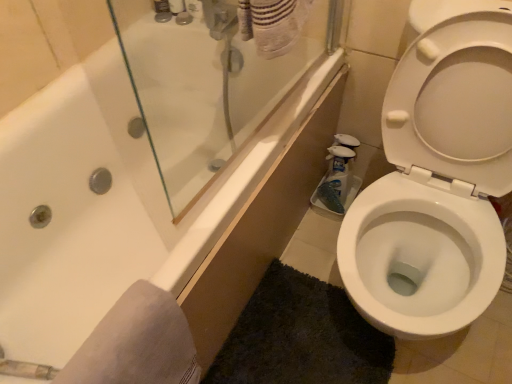
The image size is (512, 384). What do you see at coordinates (301, 337) in the screenshot? I see `dark gray shaggy bath mat at lower right` at bounding box center [301, 337].

In order to face gray soft towel at lower left, should I rotate leftwards or rightwards?

Rotate left and turn 13.351 degrees.

What do you see at coordinates (437, 176) in the screenshot? The image size is (512, 384). I see `white glossy toilet at right` at bounding box center [437, 176].

The width and height of the screenshot is (512, 384). What do you see at coordinates (194, 8) in the screenshot? I see `white plastic bottle at upper center, which appears as the first toiletry when viewed from the right` at bounding box center [194, 8].

You are a GUI agent. You are given a task and a screenshot of the screen. Output one action in this format:
    pyautogui.click(x=<x>, y=<y>)
    Task: Click on the dark gray shaggy bath mat at lower right
    
    Given the screenshot: What is the action you would take?
    pyautogui.click(x=301, y=337)

From a real-world perspective, is gray soft towel at lower left under white plastic soap dispenser at upper center, the 2th toiletry positioned from the right?

Yes, from a real-world perspective, gray soft towel at lower left is under white plastic soap dispenser at upper center, the 2th toiletry positioned from the right.

Are gray soft towel at lower left and white plastic soap dispenser at upper center, acting as the second toiletry starting from the left, located far from each other?

Indeed, gray soft towel at lower left is not near white plastic soap dispenser at upper center, acting as the second toiletry starting from the left.

Is gray soft towel at lower left to the left of white plastic soap dispenser at upper center, acting as the second toiletry starting from the left, from the viewer's perspective?

No, gray soft towel at lower left is not to the left of white plastic soap dispenser at upper center, acting as the second toiletry starting from the left.

Considering the sizes of gray soft towel at lower left and white plastic soap dispenser at upper center, acting as the second toiletry starting from the left, in the image, is gray soft towel at lower left taller or shorter than white plastic soap dispenser at upper center, acting as the second toiletry starting from the left,?

Considering their sizes, gray soft towel at lower left has more height than white plastic soap dispenser at upper center, acting as the second toiletry starting from the left.

In terms of height, does dark gray shaggy bath mat at lower right look taller or shorter compared to blue glossy spray bottle at lower right?

In the image, dark gray shaggy bath mat at lower right appears to be shorter than blue glossy spray bottle at lower right.

Choose the correct answer: Is dark gray shaggy bath mat at lower right inside blue glossy spray bottle at lower right or outside it?

dark gray shaggy bath mat at lower right is located beyond the bounds of blue glossy spray bottle at lower right.

Which is behind, point (208, 379) or point (323, 187)?

The point (323, 187) is more distant.

Is dark gray shaggy bath mat at lower right further to camera compared to blue glossy spray bottle at lower right?

No, it is in front of blue glossy spray bottle at lower right.

Between point (383, 207) and point (185, 4), which one is positioned behind?

Positioned behind is point (185, 4).

Between white glossy toilet at right and white plastic bottle at upper center, which appears as the first toiletry when viewed from the right, which one has larger size?

With larger size is white glossy toilet at right.

Locate an element on the screen. the 1st toiletry behind when counting from the white glossy toilet at right is located at coordinates (x=194, y=8).

Is white glossy toilet at right further to the viewer compared to white plastic bottle at upper center, which appears as the first toiletry when viewed from the right?

No, white glossy toilet at right is closer to the camera.

From the image's perspective, is dark gray shaggy bath mat at lower right above or below white plastic soap dispenser at upper center, acting as the second toiletry starting from the left?

dark gray shaggy bath mat at lower right is situated lower than white plastic soap dispenser at upper center, acting as the second toiletry starting from the left, in the image.

Based on their positions, is dark gray shaggy bath mat at lower right located to the left or right of white plastic soap dispenser at upper center, acting as the second toiletry starting from the left?

dark gray shaggy bath mat at lower right is positioned on white plastic soap dispenser at upper center, acting as the second toiletry starting from the left,'s right side.

Measure the distance from dark gray shaggy bath mat at lower right to white plastic soap dispenser at upper center, acting as the second toiletry starting from the left.

dark gray shaggy bath mat at lower right is 1.07 meters away from white plastic soap dispenser at upper center, acting as the second toiletry starting from the left.

How different are the orientations of white plastic soap dispenser at upper center, the 2th toiletry positioned from the right, and white plastic bottle at upper center, which appears as the first toiletry when viewed from the right, in degrees?

There is a 0.00617-degree angle between the facing directions of white plastic soap dispenser at upper center, the 2th toiletry positioned from the right, and white plastic bottle at upper center, which appears as the first toiletry when viewed from the right.

Considering the sizes of objects white plastic soap dispenser at upper center, acting as the second toiletry starting from the left, and white plastic bottle at upper center, which ranks as the third toiletry in left-to-right order, in the image provided, who is taller, white plastic soap dispenser at upper center, acting as the second toiletry starting from the left, or white plastic bottle at upper center, which ranks as the third toiletry in left-to-right order,?

white plastic bottle at upper center, which ranks as the third toiletry in left-to-right order.

At what (x,y) coordinates should I click in order to perform the action: click on the 1st toiletry above the white plastic bottle at upper center, which ranks as the third toiletry in left-to-right order (from the image's perspective). Please return your answer as a coordinate pair (x, y). The image size is (512, 384). Looking at the image, I should click on (177, 6).

Is gray soft towel at lower left facing away from dark gray shaggy bath mat at lower right?

No, gray soft towel at lower left's orientation is not away from dark gray shaggy bath mat at lower right.

Is gray soft towel at lower left positioned far away from dark gray shaggy bath mat at lower right?

Actually, gray soft towel at lower left and dark gray shaggy bath mat at lower right are a little close together.

Considering the positions of point (138, 376) and point (239, 363), is point (138, 376) closer or farther from the camera than point (239, 363)?

Point (138, 376) appears to be closer to the viewer than point (239, 363).

Considering the sizes of gray soft towel at lower left and dark gray shaggy bath mat at lower right in the image, is gray soft towel at lower left wider or thinner than dark gray shaggy bath mat at lower right?

Clearly, gray soft towel at lower left has less width compared to dark gray shaggy bath mat at lower right.

From the image's perspective, which is above, dark gray shaggy bath mat at lower right or white plastic bottle at upper center, which appears as the first toiletry when viewed from the right?

white plastic bottle at upper center, which appears as the first toiletry when viewed from the right, is shown above in the image.

Considering the positions of objects dark gray shaggy bath mat at lower right and white plastic bottle at upper center, which appears as the first toiletry when viewed from the right, in the image provided, who is in front, dark gray shaggy bath mat at lower right or white plastic bottle at upper center, which appears as the first toiletry when viewed from the right,?

Positioned in front is dark gray shaggy bath mat at lower right.

Considering the relative sizes of dark gray shaggy bath mat at lower right and white plastic bottle at upper center, which appears as the first toiletry when viewed from the right, in the image provided, is dark gray shaggy bath mat at lower right wider than white plastic bottle at upper center, which appears as the first toiletry when viewed from the right,?

Indeed, dark gray shaggy bath mat at lower right has a greater width compared to white plastic bottle at upper center, which appears as the first toiletry when viewed from the right.

Considering the sizes of dark gray shaggy bath mat at lower right and white plastic bottle at upper center, which appears as the first toiletry when viewed from the right, in the image, is dark gray shaggy bath mat at lower right taller or shorter than white plastic bottle at upper center, which appears as the first toiletry when viewed from the right,?

Clearly, dark gray shaggy bath mat at lower right is shorter compared to white plastic bottle at upper center, which appears as the first toiletry when viewed from the right.

Where is `bath towel that is in front of the white plastic soap dispenser at upper center, the 2th toiletry positioned from the right`? Image resolution: width=512 pixels, height=384 pixels. bath towel that is in front of the white plastic soap dispenser at upper center, the 2th toiletry positioned from the right is located at coordinates (137, 343).

The image size is (512, 384). I want to click on bath mat directly beneath the blue glossy spray bottle at lower right (from a real-world perspective), so click(x=301, y=337).

From the picture: Estimate the real-world distances between objects in this image. Which object is further from white plastic bottle at upper center, which ranks as the third toiletry in left-to-right order, dark gray shaggy bath mat at lower right or white glossy toilet at right?

Among the two, dark gray shaggy bath mat at lower right is located further to white plastic bottle at upper center, which ranks as the third toiletry in left-to-right order.

Which object lies further to the anchor point matte plastic soap dispenser at upper center, placed as the third toiletry when sorted from right to left, white plastic soap dispenser at upper center, the 2th toiletry positioned from the right, or white plastic bottle at upper center, which ranks as the third toiletry in left-to-right order?

The object further to matte plastic soap dispenser at upper center, placed as the third toiletry when sorted from right to left, is white plastic bottle at upper center, which ranks as the third toiletry in left-to-right order.

From the image, which object appears to be farther from blue glossy spray bottle at lower right, gray soft towel at lower left or white glossy toilet at right?

Among the two, gray soft towel at lower left is located further to blue glossy spray bottle at lower right.

Which object lies further to the anchor point white glossy toilet at right, gray soft towel at lower left or white plastic soap dispenser at upper center, acting as the second toiletry starting from the left?

Based on the image, white plastic soap dispenser at upper center, acting as the second toiletry starting from the left, appears to be further to white glossy toilet at right.

Looking at the image, which one is located closer to white plastic soap dispenser at upper center, acting as the second toiletry starting from the left, white plastic bottle at upper center, which ranks as the third toiletry in left-to-right order, or white glossy toilet at right?

The object closer to white plastic soap dispenser at upper center, acting as the second toiletry starting from the left, is white plastic bottle at upper center, which ranks as the third toiletry in left-to-right order.

When comparing their distances from gray soft towel at lower left, does dark gray shaggy bath mat at lower right or white plastic soap dispenser at upper center, acting as the second toiletry starting from the left, seem closer?

Among the two, dark gray shaggy bath mat at lower right is located nearer to gray soft towel at lower left.

Based on their spatial positions, is gray soft towel at lower left or matte plastic soap dispenser at upper center, placed as the third toiletry when sorted from right to left, further from dark gray shaggy bath mat at lower right?

matte plastic soap dispenser at upper center, placed as the third toiletry when sorted from right to left.

Based on their spatial positions, is blue glossy spray bottle at lower right or gray soft towel at lower left further from white plastic soap dispenser at upper center, the 2th toiletry positioned from the right?

gray soft towel at lower left lies further to white plastic soap dispenser at upper center, the 2th toiletry positioned from the right, than the other object.

Locate an element on the screen. The image size is (512, 384). bath towel between white glossy toilet at right and blue glossy spray bottle at lower right in the front-back direction is located at coordinates (137, 343).

You are a GUI agent. You are given a task and a screenshot of the screen. Output one action in this format:
    pyautogui.click(x=<x>, y=<y>)
    Task: Click on the cleaning product between matte plastic soap dispenser at upper center, placed as the third toiletry when sorted from right to left, and dark gray shaggy bath mat at lower right, in the vertical direction
    
    Given the screenshot: What is the action you would take?
    pyautogui.click(x=336, y=179)

The width and height of the screenshot is (512, 384). Identify the location of toilet between matte plastic soap dispenser at upper center, the first toiletry from the left, and gray soft towel at lower left from top to bottom. (437, 176).

Locate an element on the screen. This screenshot has width=512, height=384. toiletry between white plastic soap dispenser at upper center, the 2th toiletry positioned from the right, and dark gray shaggy bath mat at lower right in the up-down direction is located at coordinates (194, 8).